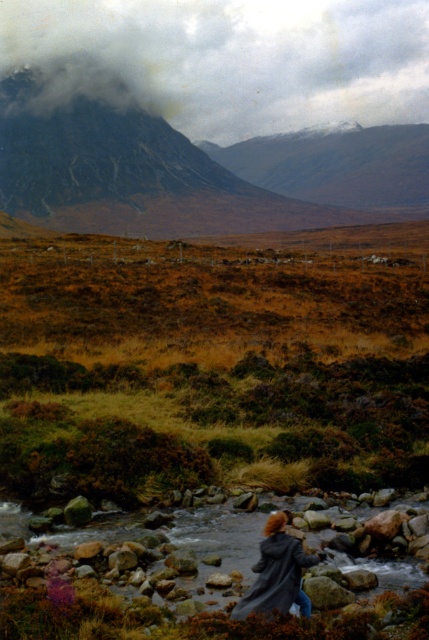
Looking at this image, does rugged stone mountain at upper left have a smaller size compared to smooth rock river at lower center?

No.

Is rugged stone mountain at upper left shorter than smooth rock river at lower center?

No, rugged stone mountain at upper left is not shorter than smooth rock river at lower center.

What do you see at coordinates (138, 177) in the screenshot? I see `rugged stone mountain at upper left` at bounding box center [138, 177].

Image resolution: width=429 pixels, height=640 pixels. Identify the location of rugged stone mountain at upper left. (138, 177).

Between cloudy gray mountain at upper center and dark gray coat at center, which one appears on the right side from the viewer's perspective?

From the viewer's perspective, dark gray coat at center appears more on the right side.

Between cloudy gray mountain at upper center and dark gray coat at center, which one has more height?

Standing taller between the two is cloudy gray mountain at upper center.

Does point (111, 20) lie behind point (295, 556)?

Yes.

Where is `cloudy gray mountain at upper center`? This screenshot has width=429, height=640. cloudy gray mountain at upper center is located at coordinates (229, 60).

Measure the distance between point (94, 93) and camera.

756.24 feet

Consider the image. Is cloudy gray mountain at upper center to the right of smooth rock river at lower center from the viewer's perspective?

No, cloudy gray mountain at upper center is not to the right of smooth rock river at lower center.

Where is `cloudy gray mountain at upper center`? cloudy gray mountain at upper center is located at coordinates (229, 60).